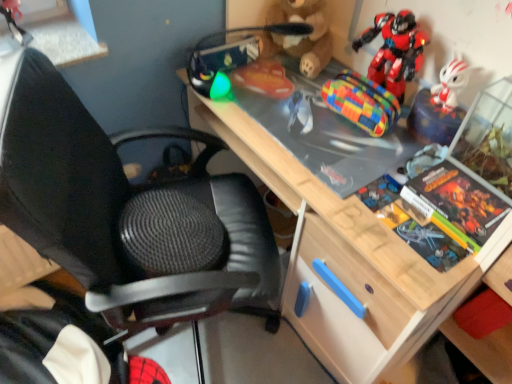
What do you see at coordinates (362, 102) in the screenshot? I see `multicolored woven pouch at center, placed as the third toy when sorted from left to right` at bounding box center [362, 102].

What do you see at coordinates (374, 232) in the screenshot? I see `wooden desk at center` at bounding box center [374, 232].

Describe the element at coordinates (395, 50) in the screenshot. I see `shiny plastic robot at upper right, which is counted as the 4th toy, starting from the left` at that location.

Find the location of a particular element. Image resolution: width=512 pixels, height=384 pixels. black mesh chair at center is located at coordinates (119, 208).

Do you think rubberized orange toy at upper center, arranged as the first toy when viewed from the left, is within hardcover book at right, or outside of it?

rubberized orange toy at upper center, arranged as the first toy when viewed from the left, is located beyond the bounds of hardcover book at right.

Which of these two, rubberized orange toy at upper center, which is the 4th toy in right-to-left order, or hardcover book at right, is smaller?

Smaller between the two is hardcover book at right.

Looking at this image, from the image's perspective, does rubberized orange toy at upper center, arranged as the first toy when viewed from the left, appear lower than hardcover book at right?

No, from the image's perspective, rubberized orange toy at upper center, arranged as the first toy when viewed from the left, is not below hardcover book at right.

Does rubberized orange toy at upper center, arranged as the first toy when viewed from the left, have a greater width compared to hardcover book at right?

Correct, the width of rubberized orange toy at upper center, arranged as the first toy when viewed from the left, exceeds that of hardcover book at right.

From a real-world perspective, is rubberized orange toy at upper center, which is the 4th toy in right-to-left order, on top of shiny plastic robot at upper right, which is counted as the 4th toy, starting from the left?

No, from a real-world perspective, rubberized orange toy at upper center, which is the 4th toy in right-to-left order, is not over shiny plastic robot at upper right, which is counted as the 4th toy, starting from the left

You are a GUI agent. You are given a task and a screenshot of the screen. Output one action in this format:
    pyautogui.click(x=<x>, y=<y>)
    Task: Click on the 1st toy above the rubberized orange toy at upper center, arranged as the first toy when viewed from the left (from the image's perspective)
    
    Given the screenshot: What is the action you would take?
    pyautogui.click(x=395, y=50)

Between rubberized orange toy at upper center, which is the 4th toy in right-to-left order, and shiny plastic robot at upper right, which appears as the 1th toy when viewed from the right, which one has smaller size?

With smaller size is shiny plastic robot at upper right, which appears as the 1th toy when viewed from the right.

In the scene shown: Is rubberized orange toy at upper center, arranged as the first toy when viewed from the left, turned away from shiny plastic robot at upper right, which appears as the 1th toy when viewed from the right?

That's not correct — rubberized orange toy at upper center, arranged as the first toy when viewed from the left, is not looking away from shiny plastic robot at upper right, which appears as the 1th toy when viewed from the right.

Is point (382, 82) in front of point (476, 210)?

No, it is not.

Is shiny plastic robot at upper right, which appears as the 1th toy when viewed from the right, to the left or to the right of wooden desk at center in the image?

Based on their positions, shiny plastic robot at upper right, which appears as the 1th toy when viewed from the right, is located to the right of wooden desk at center.

Which is correct: shiny plastic robot at upper right, which appears as the 1th toy when viewed from the right, is inside wooden desk at center, or outside of it?

shiny plastic robot at upper right, which appears as the 1th toy when viewed from the right, fits inside wooden desk at center.

Which object is closer to the camera taking this photo, shiny plastic robot at upper right, which is counted as the 4th toy, starting from the left, or wooden desk at center?

wooden desk at center.

From a real-world perspective, who is located lower, black mesh chair at center or shiny plastic robot at upper right, which is counted as the 4th toy, starting from the left?

black mesh chair at center.

Is black mesh chair at center positioned with its back to shiny plastic robot at upper right, which is counted as the 4th toy, starting from the left?

No, shiny plastic robot at upper right, which is counted as the 4th toy, starting from the left, is not at the back of black mesh chair at center.

Is black mesh chair at center at the left side of shiny plastic robot at upper right, which is counted as the 4th toy, starting from the left?

Yes.

Who is smaller, black mesh chair at center or shiny plastic robot at upper right, which is counted as the 4th toy, starting from the left?

shiny plastic robot at upper right, which is counted as the 4th toy, starting from the left, is smaller.

From a real-world perspective, between black mesh chair at center and multicolored woven pouch at center, placed as the third toy when sorted from left to right, who is vertically higher?

In real-world perspective, multicolored woven pouch at center, placed as the third toy when sorted from left to right, is above.

In terms of width, does black mesh chair at center look wider or thinner when compared to multicolored woven pouch at center, placed as the third toy when sorted from left to right?

black mesh chair at center is wider than multicolored woven pouch at center, placed as the third toy when sorted from left to right.

Can you confirm if black mesh chair at center is positioned to the left of multicolored woven pouch at center, arranged as the second toy when viewed from the right?

Correct, you'll find black mesh chair at center to the left of multicolored woven pouch at center, arranged as the second toy when viewed from the right.

Is black mesh chair at center spatially inside multicolored woven pouch at center, placed as the third toy when sorted from left to right, or outside of it?

black mesh chair at center is located beyond the bounds of multicolored woven pouch at center, placed as the third toy when sorted from left to right.

From the image's perspective, does rubberized orange toy at upper center, arranged as the first toy when viewed from the left, appear higher than wooden desk at center?

Yes, from the image's perspective, rubberized orange toy at upper center, arranged as the first toy when viewed from the left, is above wooden desk at center.

Are rubberized orange toy at upper center, which is the 4th toy in right-to-left order, and wooden desk at center far apart?

No, rubberized orange toy at upper center, which is the 4th toy in right-to-left order, is not far from wooden desk at center.

From a real-world perspective, who is located lower, rubberized orange toy at upper center, which is the 4th toy in right-to-left order, or wooden desk at center?

wooden desk at center.

Choose the correct answer: Is rubberized orange toy at upper center, arranged as the first toy when viewed from the left, inside wooden desk at center or outside it?

rubberized orange toy at upper center, arranged as the first toy when viewed from the left, is enclosed within wooden desk at center.

Can you confirm if wooden desk at center is bigger than shiny plastic robot at upper right, which is counted as the 4th toy, starting from the left?

Correct, wooden desk at center is larger in size than shiny plastic robot at upper right, which is counted as the 4th toy, starting from the left.

Can you tell me how much wooden desk at center and shiny plastic robot at upper right, which is counted as the 4th toy, starting from the left, differ in facing direction?

The angle between the facing direction of wooden desk at center and the facing direction of shiny plastic robot at upper right, which is counted as the 4th toy, starting from the left, is 1.97 degrees.

Could you tell me if wooden desk at center is turned towards shiny plastic robot at upper right, which appears as the 1th toy when viewed from the right?

Yes, wooden desk at center is aimed at shiny plastic robot at upper right, which appears as the 1th toy when viewed from the right.

Is wooden desk at center at the right side of shiny plastic robot at upper right, which is counted as the 4th toy, starting from the left?

No, wooden desk at center is not to the right of shiny plastic robot at upper right, which is counted as the 4th toy, starting from the left.

Where is `book in front of the rubberized orange toy at upper center, which is the 4th toy in right-to-left order`? The image size is (512, 384). book in front of the rubberized orange toy at upper center, which is the 4th toy in right-to-left order is located at coordinates (439, 213).

The width and height of the screenshot is (512, 384). In order to click on toy that is the 3rd one when counting rightward from the rubberized orange toy at upper center, which is the 4th toy in right-to-left order in this screenshot , I will do `click(395, 50)`.

Estimate the real-world distances between objects in this image. Which object is further from black mesh chair at center, multicolored woven pouch at center, placed as the third toy when sorted from left to right, or wooden desk at center?

multicolored woven pouch at center, placed as the third toy when sorted from left to right, is positioned further to the anchor black mesh chair at center.

Looking at the image, which one is located further to rubberized orange toy at upper center, which is the 4th toy in right-to-left order, shiny plastic robot at upper right, which appears as the 1th toy when viewed from the right, or hardcover book at right?

hardcover book at right.

Looking at the image, which one is located further to wooden desk at center, brown plush bear at upper center, the 3th toy viewed from the right, or black mesh chair at center?

brown plush bear at upper center, the 3th toy viewed from the right, lies further to wooden desk at center than the other object.

Estimate the real-world distances between objects in this image. Which object is further from hardcover book at right, multicolored woven pouch at center, arranged as the second toy when viewed from the right, or black mesh chair at center?

black mesh chair at center is further to hardcover book at right.

From the image, which object appears to be farther from wooden desk at center, black mesh chair at center or shiny plastic robot at upper right, which appears as the 1th toy when viewed from the right?

Based on the image, shiny plastic robot at upper right, which appears as the 1th toy when viewed from the right, appears to be further to wooden desk at center.

When comparing their distances from wooden desk at center, does hardcover book at right or brown plush bear at upper center, acting as the second toy starting from the left, seem further?

The object further to wooden desk at center is brown plush bear at upper center, acting as the second toy starting from the left.

Which object lies further to the anchor point shiny plastic robot at upper right, which is counted as the 4th toy, starting from the left, brown plush bear at upper center, the 3th toy viewed from the right, or multicolored woven pouch at center, placed as the third toy when sorted from left to right?

brown plush bear at upper center, the 3th toy viewed from the right, is further to shiny plastic robot at upper right, which is counted as the 4th toy, starting from the left.

When comparing their distances from black mesh chair at center, does brown plush bear at upper center, acting as the second toy starting from the left, or multicolored woven pouch at center, placed as the third toy when sorted from left to right, seem further?

brown plush bear at upper center, acting as the second toy starting from the left, lies further to black mesh chair at center than the other object.

The height and width of the screenshot is (384, 512). Find the location of `book located between wooden desk at center and shiny plastic robot at upper right, which is counted as the 4th toy, starting from the left, in the depth direction`. book located between wooden desk at center and shiny plastic robot at upper right, which is counted as the 4th toy, starting from the left, in the depth direction is located at coordinates (439, 213).

Find the location of a particular element. The image size is (512, 384). toy between wooden desk at center and shiny plastic robot at upper right, which is counted as the 4th toy, starting from the left, in the front-back direction is located at coordinates (231, 52).

At what (x,y) coordinates should I click in order to perform the action: click on chair positioned between wooden desk at center and multicolored woven pouch at center, placed as the third toy when sorted from left to right, from near to far. Please return your answer as a coordinate pair (x, y). The height and width of the screenshot is (384, 512). Looking at the image, I should click on (119, 208).

Where is `book positioned between wooden desk at center and rubberized orange toy at upper center, which is the 4th toy in right-to-left order, from near to far`? The image size is (512, 384). book positioned between wooden desk at center and rubberized orange toy at upper center, which is the 4th toy in right-to-left order, from near to far is located at coordinates (439, 213).